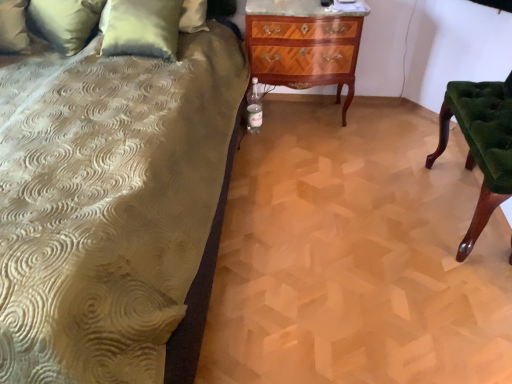
Question: From the image's perspective, is mahogany wood chest of drawers at center positioned above or below green velvet chair at right?

Choices:
 (A) above
 (B) below

Answer: (A)

Question: From a real-world perspective, is mahogany wood chest of drawers at center physically located above or below green velvet chair at right?

Choices:
 (A) above
 (B) below

Answer: (A)

Question: Which is nearer to the mahogany wood chest of drawers at center?

Choices:
 (A) velvet green pillow at upper left, which is the 1th pillow from right to left
 (B) green velvet chair at right
 (C) green textured pillow at upper left, which is the 2th pillow in right-to-left order

Answer: (A)

Question: Which object is the closest to the green velvet chair at right?

Choices:
 (A) mahogany wood chest of drawers at center
 (B) velvet green pillow at upper left, which is the 1th pillow from right to left
 (C) green textured pillow at upper left, which is the 2th pillow in right-to-left order

Answer: (A)